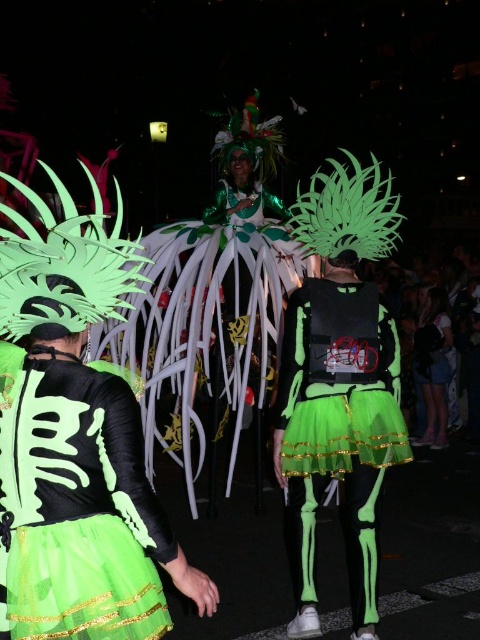
Question: Is neon green mesh dress at center closer to the viewer compared to neon green fabric skeleton at center?

Choices:
 (A) yes
 (B) no

Answer: (A)

Question: Considering the real-world distances, which object is closest to the neon green mesh dress at center?

Choices:
 (A) neon green fabric skeleton at center
 (B) green fabric costume at center

Answer: (A)

Question: Which object appears closest to the camera in this image?

Choices:
 (A) green fabric costume at center
 (B) neon green mesh dress at center

Answer: (B)

Question: Does neon green fabric skeleton at center have a greater width compared to green fabric costume at center?

Choices:
 (A) no
 (B) yes

Answer: (B)

Question: Which is farther from the green fabric costume at center?

Choices:
 (A) neon green mesh dress at center
 (B) neon green fabric skeleton at center

Answer: (A)

Question: Does neon green fabric skeleton at center have a greater width compared to green fabric costume at center?

Choices:
 (A) yes
 (B) no

Answer: (A)